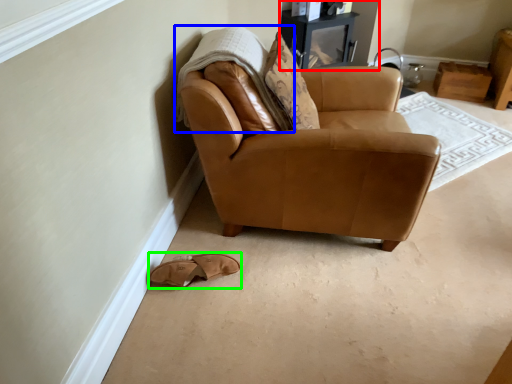
Question: Based on their relative distances, which object is farther from entertainment center (highlighted by a red box)? Choose from blanket (highlighted by a blue box) and footwear (highlighted by a green box).

Choices:
 (A) blanket
 (B) footwear

Answer: (B)